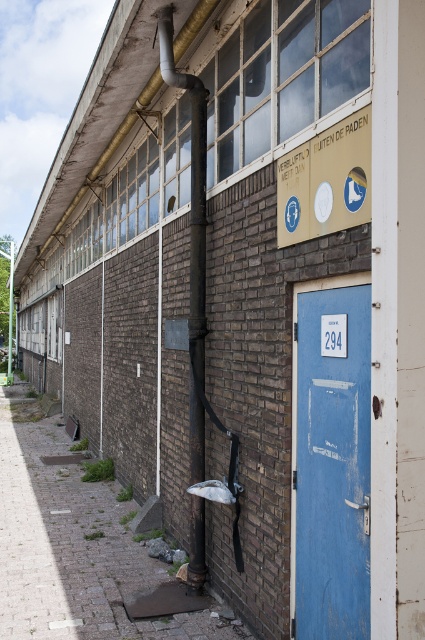
You are a delivery person trying to deliver a package to the building. You need to locate the entrance. Based on the image, which object would you approach first, the blue matte door at center or the yellow matte sign at upper center?

The blue matte door at center is larger in size than the yellow matte sign at upper center, so you should approach the blue matte door at center first as it is more likely to be the entrance.